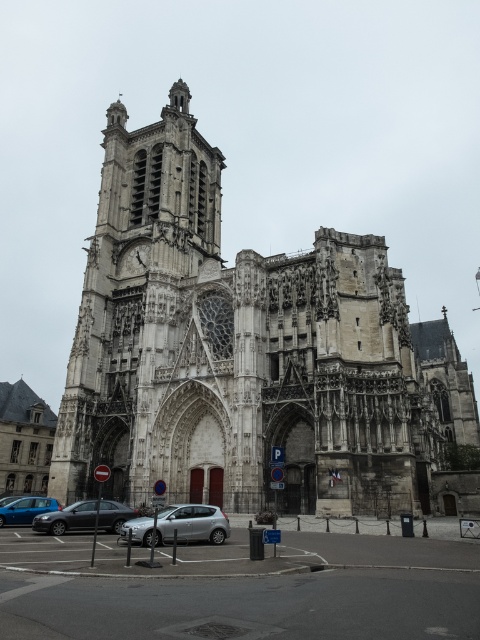
You are a photographer planning to capture the stone gothic church at center and the blue metallic car at lower left in a single wide shot. Based on their sizes, which object should you position closer to the camera to ensure both fit within the frame?

Since the stone gothic church at center is wider than the blue metallic car at lower left, positioning the blue metallic car at lower left closer to the camera would help balance their sizes in the frame, ensuring both fit well within the shot.

You are a parking attendant and need to fit both the silver metallic hatchback at lower center and the silver metallic sedan at center into a parking spot that can only accommodate vehicles up to the size of the smaller car. Which car should you prioritize fitting into the spot first?

The silver metallic sedan at center is smaller than the silver metallic hatchback at lower center. Therefore, you should prioritize fitting the silver metallic sedan at center into the parking spot first since it meets the size requirement.

You are a photographer standing in front of the cathedral. You want to capture a photo that includes both the stone gothic church at center and the blue metallic car at lower left. Based on their positions, which one should appear higher in the photo?

The stone gothic church at center is above the blue metallic car at lower left, so it will appear higher in the photo.